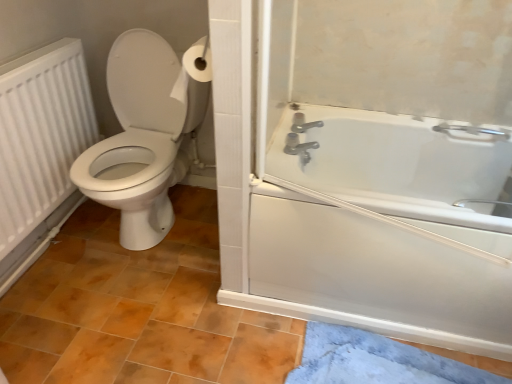
Question: Should I look upward or downward to see white plastic bathtub at right?

Choices:
 (A) down
 (B) up

Answer: (B)

Question: Considering the relative sizes of brown matte tile at lower center and white matte radiator at left in the image provided, is brown matte tile at lower center shorter than white matte radiator at left?

Choices:
 (A) no
 (B) yes

Answer: (B)

Question: From a real-world perspective, is brown matte tile at lower center on top of white matte radiator at left?

Choices:
 (A) yes
 (B) no

Answer: (B)

Question: Considering the relative positions of brown matte tile at lower center and white matte radiator at left in the image provided, is brown matte tile at lower center to the left of white matte radiator at left from the viewer's perspective?

Choices:
 (A) no
 (B) yes

Answer: (A)

Question: Is brown matte tile at lower center outside white matte radiator at left?

Choices:
 (A) no
 (B) yes

Answer: (B)

Question: Could you tell me if brown matte tile at lower center is turned towards white matte radiator at left?

Choices:
 (A) yes
 (B) no

Answer: (B)

Question: Are brown matte tile at lower center and white matte radiator at left located far from each other?

Choices:
 (A) no
 (B) yes

Answer: (A)

Question: Can you confirm if white plastic bathtub at right is positioned to the left of white matte radiator at left?

Choices:
 (A) no
 (B) yes

Answer: (A)

Question: Is white plastic bathtub at right positioned beyond the bounds of white matte radiator at left?

Choices:
 (A) no
 (B) yes

Answer: (B)

Question: Considering the relative sizes of white plastic bathtub at right and white matte radiator at left in the image provided, is white plastic bathtub at right thinner than white matte radiator at left?

Choices:
 (A) no
 (B) yes

Answer: (B)

Question: From a real-world perspective, is white plastic bathtub at right under white matte radiator at left?

Choices:
 (A) no
 (B) yes

Answer: (A)

Question: From the image's perspective, is white plastic bathtub at right on top of white matte radiator at left?

Choices:
 (A) yes
 (B) no

Answer: (B)

Question: Does white plastic bathtub at right come in front of white matte radiator at left?

Choices:
 (A) yes
 (B) no

Answer: (A)

Question: Is blue plush bath mat at lower right aimed at white matte radiator at left?

Choices:
 (A) yes
 (B) no

Answer: (B)